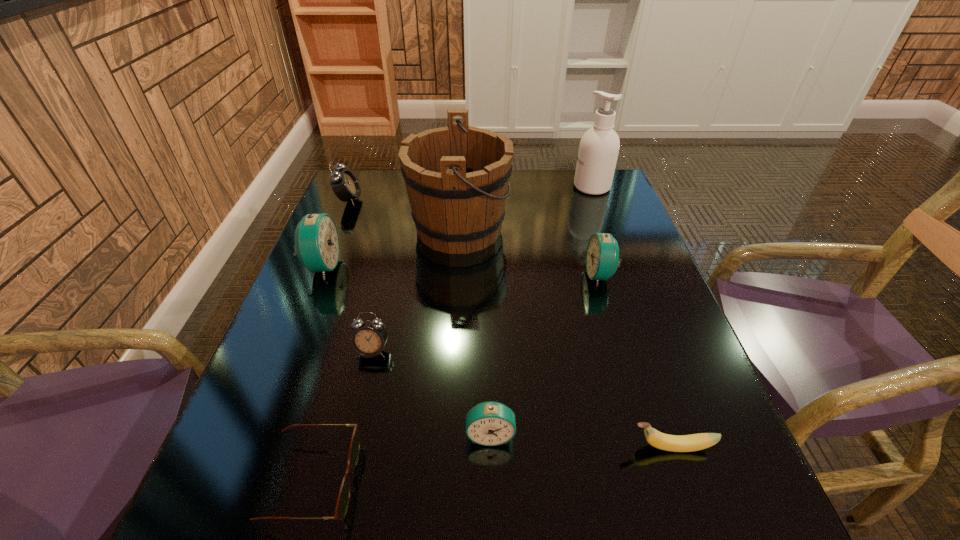
Identify the location of blue alarm clock identified as the second closest to the bigger white alarm clock. (602, 256).

Locate an element on the screen. This screenshot has height=540, width=960. blue alarm clock that is the closest to the second blue alarm clock from left to right is located at coordinates (602, 256).

What are the coordinates of `free spot that satisfies the following two spatial constraints: 1. on the side of the wine bucket with the handle for carrying; 2. on the face of the right white alarm clock` in the screenshot? It's located at (452, 351).